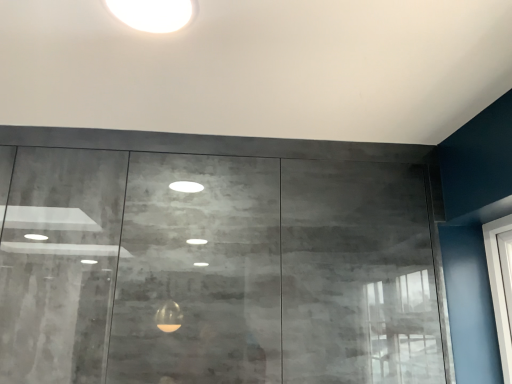
What is the approximate height of white glossy droplight at upper center?

white glossy droplight at upper center is 0.74 inches in height.

I want to click on white glossy droplight at upper center, so click(152, 14).

Describe the element at coordinates (152, 14) in the screenshot. I see `white glossy droplight at upper center` at that location.

Locate an element on the screen. The image size is (512, 384). white glossy droplight at upper center is located at coordinates (152, 14).